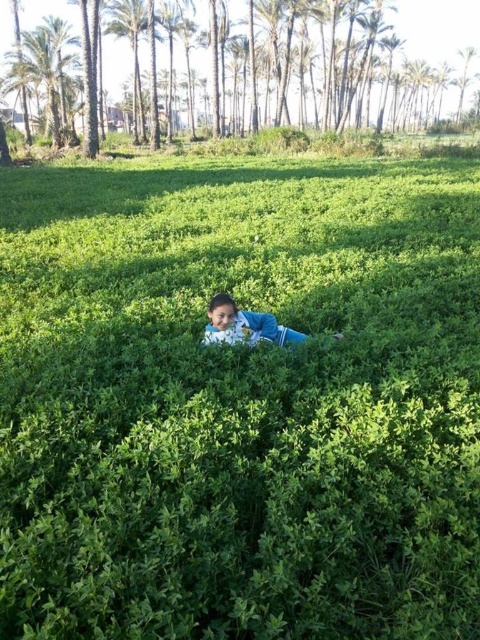
Which is above, blue fabric child at center or green leafy palm tree at upper center?

green leafy palm tree at upper center is higher up.

Does blue fabric child at center come behind green leafy palm tree at upper center?

No, it is in front of green leafy palm tree at upper center.

What do you see at coordinates (244, 324) in the screenshot?
I see `blue fabric child at center` at bounding box center [244, 324].

Locate an element on the screen. Image resolution: width=480 pixels, height=640 pixels. blue fabric child at center is located at coordinates (244, 324).